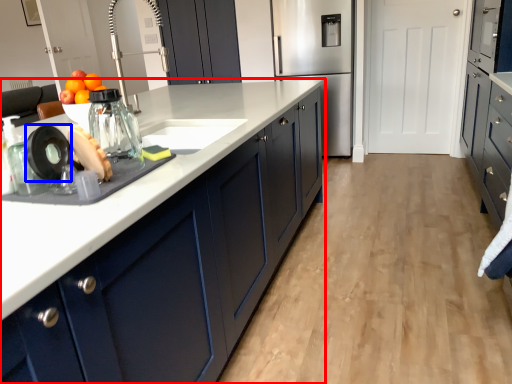
Question: Among these objects, which one is farthest to the camera, cabinetry (highlighted by a red box) or appliance (highlighted by a blue box)?

Choices:
 (A) cabinetry
 (B) appliance

Answer: (B)